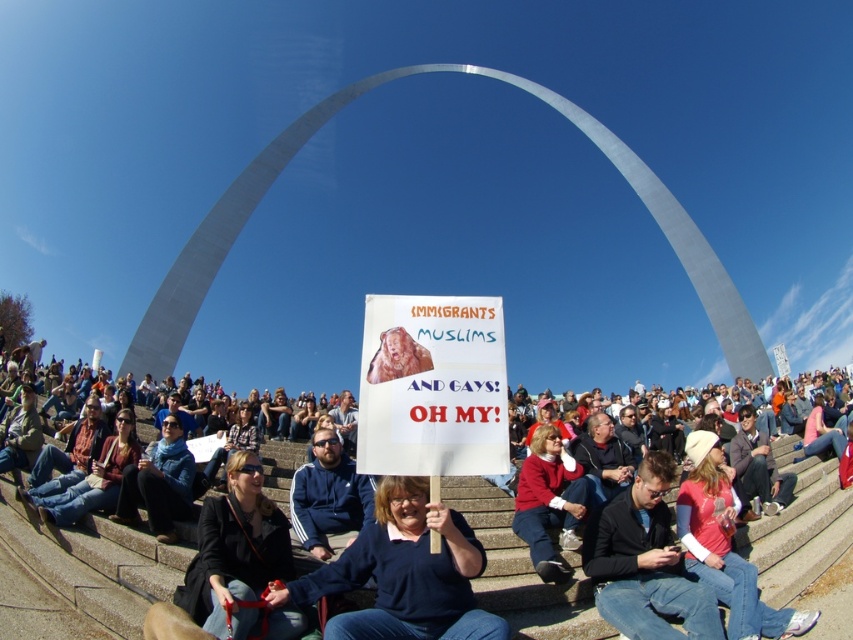
From the picture: Is blue denim jeans at center above dark brown leather jacket at center?

Yes.

Who is shorter, blue denim jeans at center or dark brown leather jacket at center?

With less height is blue denim jeans at center.

Between point (99, 532) and point (664, 547), which one is positioned behind?

The point (664, 547) is behind.

Where is `blue denim jeans at center`? Image resolution: width=853 pixels, height=640 pixels. blue denim jeans at center is located at coordinates (97, 563).

Between blue sweater at center and dark brown leather jacket at center, which one is positioned higher?

blue sweater at center is above.

Is blue sweater at center taller than dark brown leather jacket at center?

No.

This screenshot has height=640, width=853. Find the location of `blue sweater at center`. blue sweater at center is located at coordinates (404, 573).

Where is `blue sweater at center`? This screenshot has width=853, height=640. blue sweater at center is located at coordinates (404, 573).

Who is more distant from viewer, (x=799, y=564) or (x=448, y=632)?

Point (x=799, y=564)

Between blue denim jeans at center and blue sweater at center, which one has less height?

blue denim jeans at center

Locate an element on the screen. blue denim jeans at center is located at coordinates (97, 563).